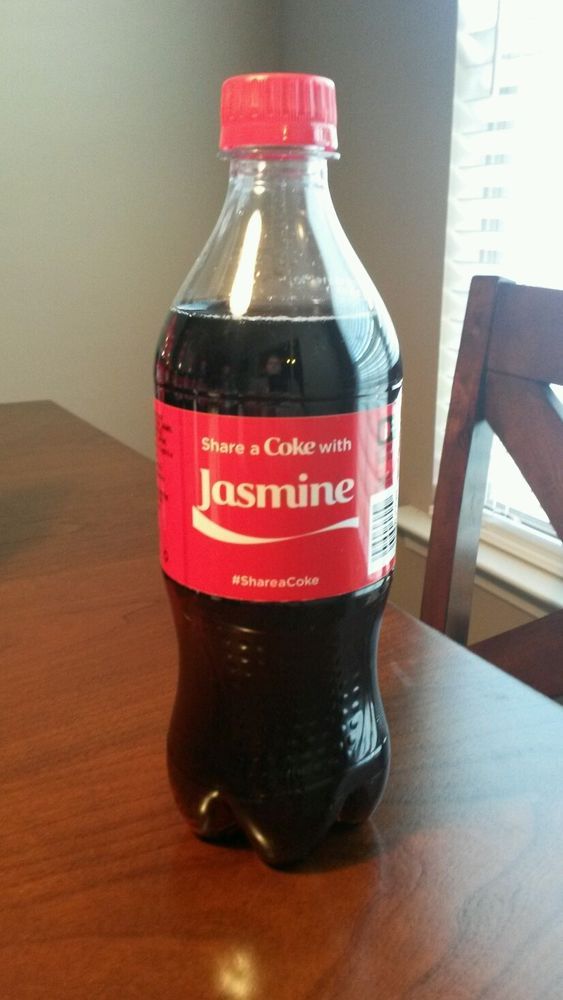
Locate an element on the screen. wood chair is located at coordinates (499, 382).